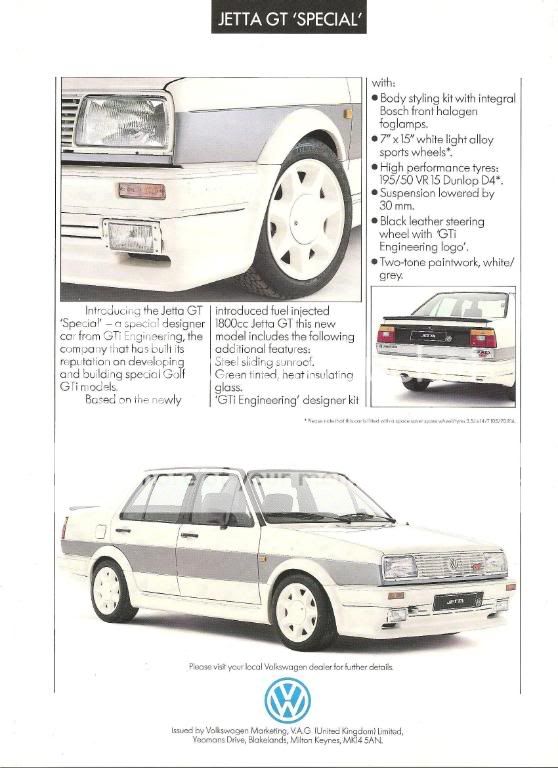
This screenshot has height=768, width=558. What are the coordinates of `gas cover` in the screenshot? It's located at (101, 531).